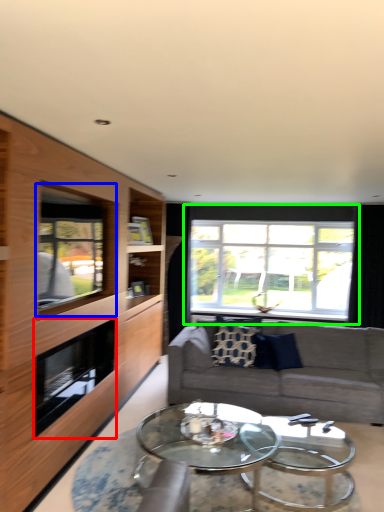
Question: Based on their relative distances, which object is farther from fireplace (highlighted by a red box)? Choose from window (highlighted by a blue box) and window (highlighted by a green box).

Choices:
 (A) window
 (B) window

Answer: (B)